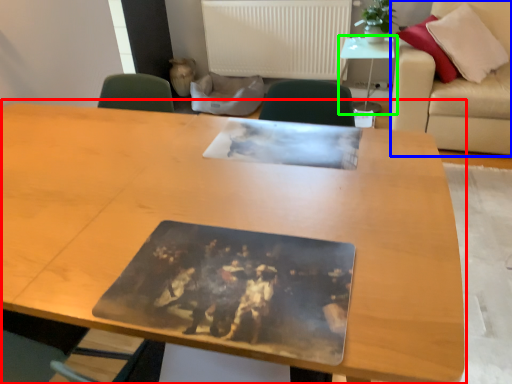
Question: Based on their relative distances, which object is nearer to table (highlighted by a red box)? Choose from couch (highlighted by a blue box) and table (highlighted by a green box).

Choices:
 (A) couch
 (B) table

Answer: (A)